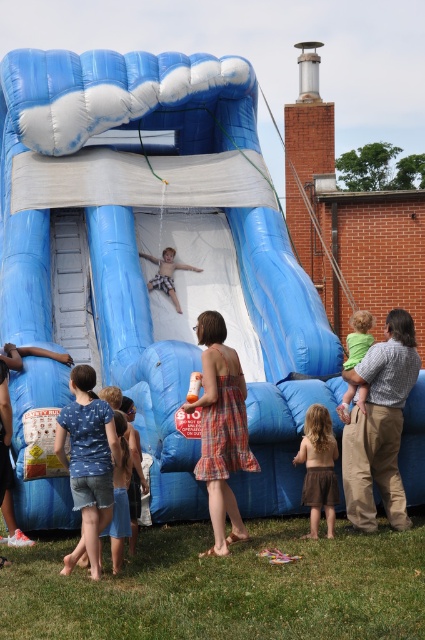
You are a photographer trying to capture a photo of the brown skirt at lower center and the matte blue shorts at center. Which object will appear larger in your photo?

The brown skirt at lower center will appear larger in the photo because it is closer to the viewer than the matte blue shorts at center.

You are standing at the starting point of the water slide and see two points marked on the slide. The first point is at coordinates point (379, 413), and the second point is at point (354, 339). Which point is closer to the top of the slide?

Point (379, 413) is in front of point (354, 339), so the point closer to the top of the slide is point (379, 413).